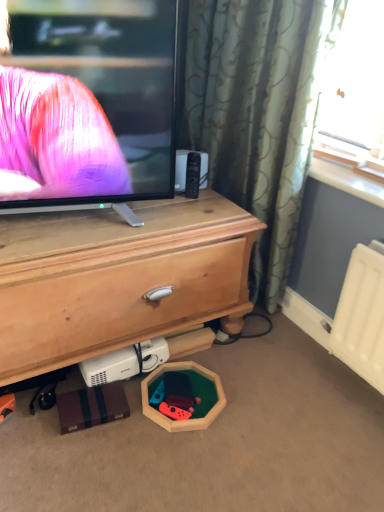
The width and height of the screenshot is (384, 512). I want to click on free space in front of wooden hexagon at lower center, which ranks as the second toy in left-to-right order, so click(175, 468).